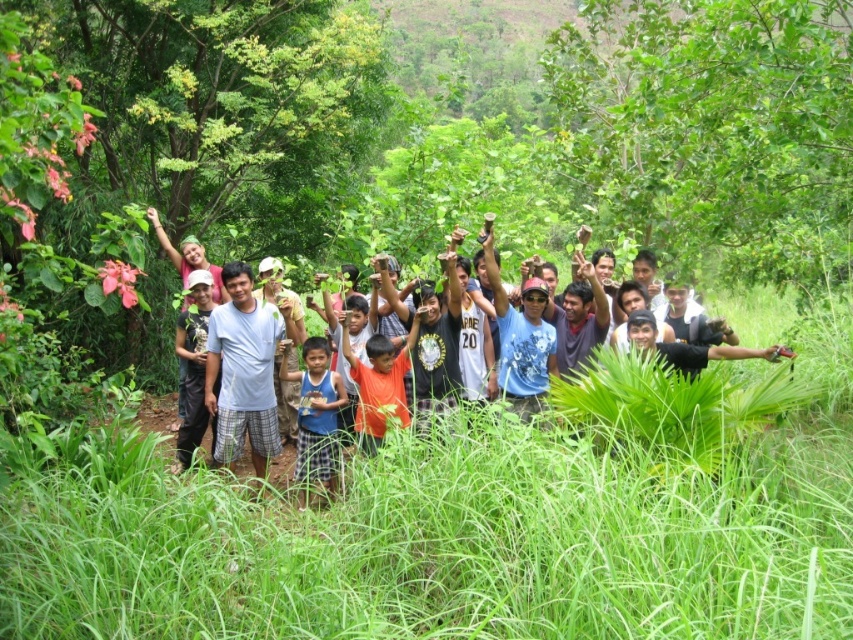
You are a photographer trying to capture a group photo of the people in the scene. You want to ensure that the blue fabric shirt at center is positioned so that it is framed by the green leafy tree at left. Based on their current positions, is this possible?

The green leafy tree at left is to the left of the blue fabric shirt at center, so the blue fabric shirt at center is positioned to the right of the tree. Therefore, the photographer can frame the blue fabric shirt at center by positioning the green leafy tree at left to its left side.

You are a photographer trying to capture a group photo of the green leafy tree at left and the blue fabric shirt at center. Which object should you focus on first if you want to ensure both are in sharp focus?

The green leafy tree at left has a lesser height compared to blue fabric shirt at center, so you should focus on the blue fabric shirt at center first to ensure both are in sharp focus.

You are standing in the middle of the group of people in the image. Which direction should you look to see the green leafy tree at left?

You should look to your left to see the green leafy tree at left since it is located at the left side of the image.